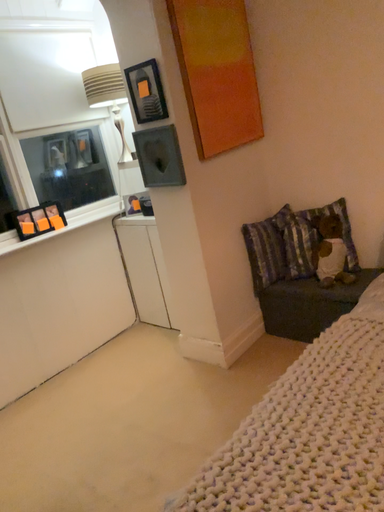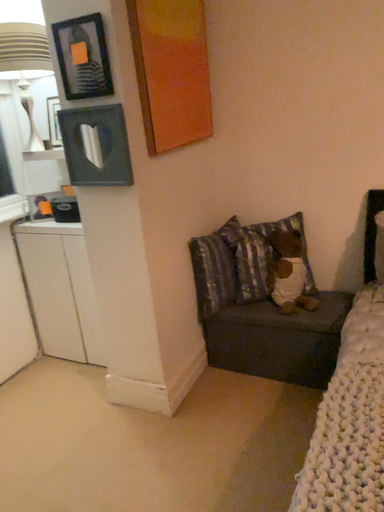
Question: Which way did the camera rotate in the video?

Choices:
 (A) rotated right
 (B) rotated left

Answer: (A)